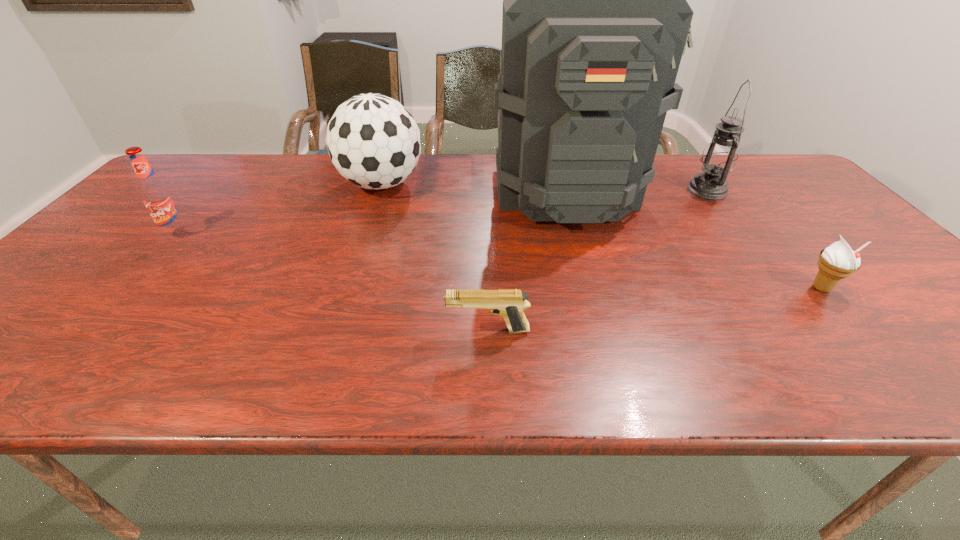
Find the location of a particular element. This screenshot has height=540, width=960. free space located 0.300m on the right of the soccer ball is located at coordinates (521, 184).

This screenshot has height=540, width=960. In order to click on free spot located 0.350m on the front of the leftmost object in this screenshot , I will do point(78,347).

The height and width of the screenshot is (540, 960). Identify the location of free location located 0.110m on the right of the icecream. (886, 288).

Where is `vacant region located 0.180m at the barrel of the nearest object`? The height and width of the screenshot is (540, 960). vacant region located 0.180m at the barrel of the nearest object is located at coordinates (358, 330).

At what (x,y) coordinates should I click in order to perform the action: click on free location located at the barrel of the nearest object. Please return your answer as a coordinate pair (x, y). Looking at the image, I should click on (315, 330).

Locate an element on the screen. The image size is (960, 540). vacant space located 0.310m at the barrel of the nearest object is located at coordinates (295, 330).

In order to click on backpack at the far edge in this screenshot , I will do `click(595, 21)`.

Identify the location of oil lamp present at the far edge. (719, 157).

Find the location of a particular element. The image size is (960, 540). soccer ball present at the far edge is located at coordinates (373, 141).

What are the coordinates of `free space at the far edge` in the screenshot? It's located at (311, 158).